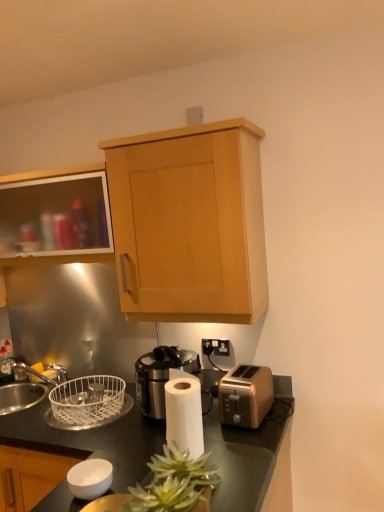
Question: From the image's perspective, relative to gold metallic toaster at lower right, is light wood cabinet at upper center, marked as the 2th cabinetry in a left-to-right arrangement, above or below?

Choices:
 (A) above
 (B) below

Answer: (A)

Question: In the image, is light wood cabinet at upper center, marked as the 2th cabinetry in a left-to-right arrangement, on the left side or the right side of gold metallic toaster at lower right?

Choices:
 (A) left
 (B) right

Answer: (A)

Question: Which is nearer to the black glossy countertop at center?

Choices:
 (A) black plastic electrical outlet at center
 (B) light wood cabinet at upper center, marked as the 2th cabinetry in a left-to-right arrangement
 (C) white wire basket at lower left
 (D) black metallic coffee machine at center
 (E) green leafy plant at center

Answer: (C)

Question: Which object is the closest to the black metallic coffee machine at center?

Choices:
 (A) matte glass cabinet at upper left, which appears as the first cabinetry when viewed from the left
 (B) white wire basket at lower left
 (C) light wood cabinet at upper center, the 1th cabinetry positioned from the right
 (D) black plastic electrical outlet at center
 (E) gold metallic toaster at lower right

Answer: (B)